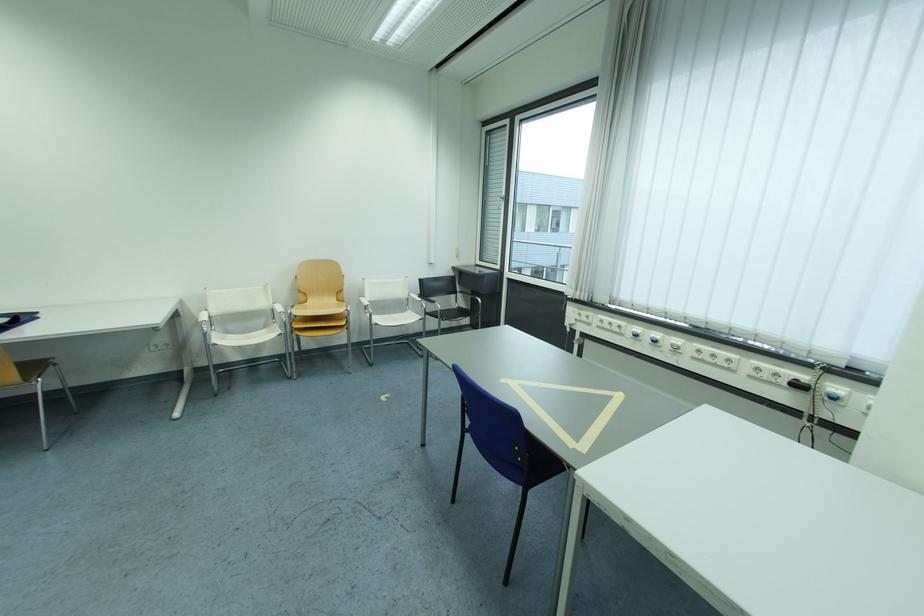
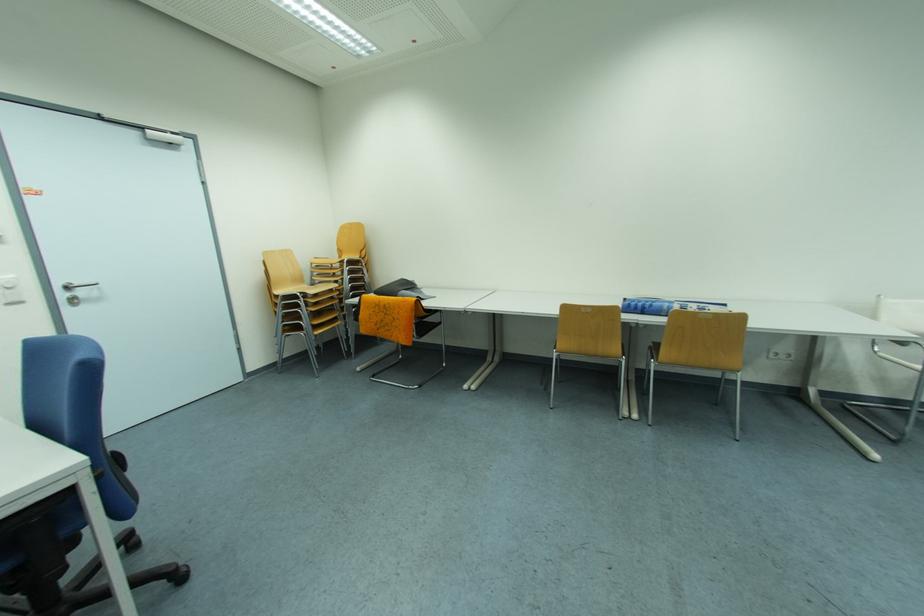
In the second image, find the point that corresponds to [161,347] in the first image.

(783, 354)